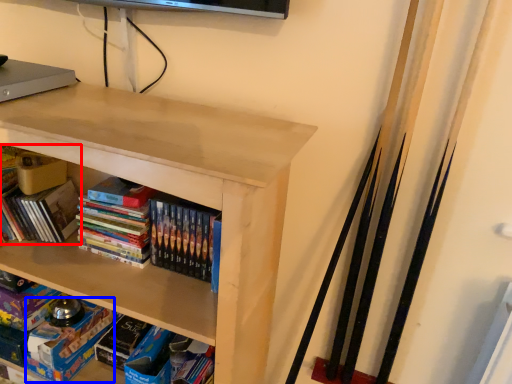
Question: Which point is further to the camera, book (highlighted by a red box) or paperback book (highlighted by a blue box)?

Choices:
 (A) book
 (B) paperback book

Answer: (B)